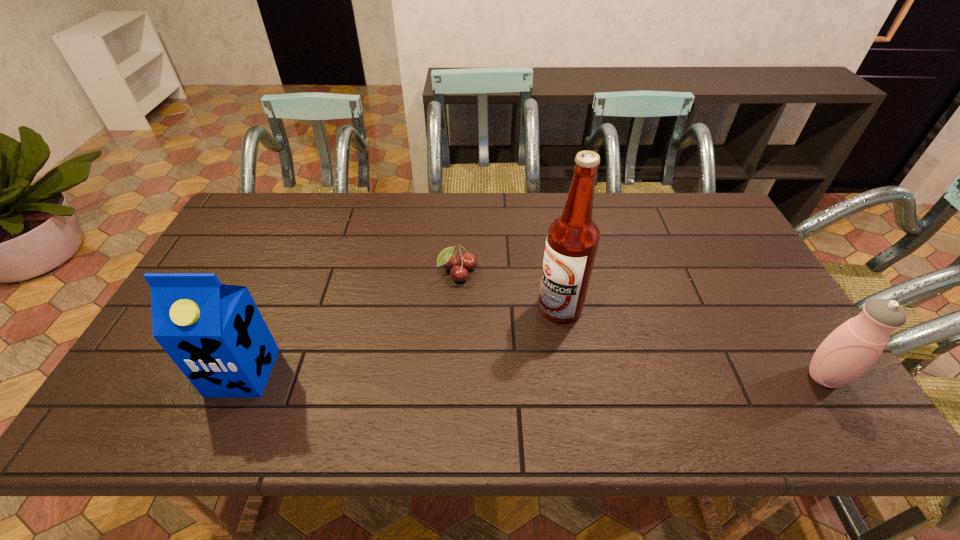
Find the location of a particular element. The image size is (960, 540). vacant space located 0.200m on the label side of the alcohol is located at coordinates (494, 365).

I want to click on vacant space located on the label side of the alcohol, so pyautogui.click(x=508, y=353).

Identify the location of vacant region located on the leaves of the shortest object. The image size is (960, 540). (518, 336).

I want to click on free spot located on the leaves of the shortest object, so click(502, 319).

Locate an element on the screen. vacant region located on the leaves of the shortest object is located at coordinates (531, 349).

Where is `carton that is at the near edge`? carton that is at the near edge is located at coordinates (215, 333).

Identify the location of thermos bottle that is at the near edge. (854, 346).

The height and width of the screenshot is (540, 960). What are the coordinates of `object situated at the right edge` in the screenshot? It's located at (854, 346).

Where is `object located at the near right corner`? The width and height of the screenshot is (960, 540). object located at the near right corner is located at coordinates (854, 346).

This screenshot has height=540, width=960. In the image, there is a desktop. In order to click on vacant area at the far edge in this screenshot , I will do `click(296, 221)`.